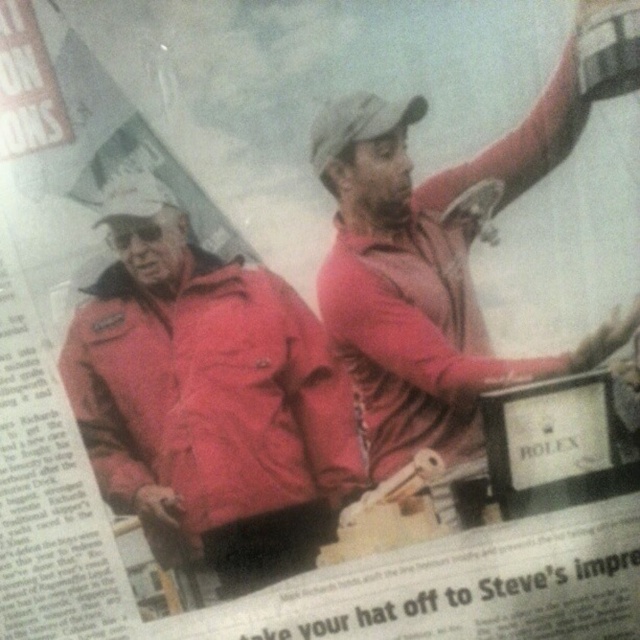
From the picture: Who is positioned more to the right, matte red jacket at center or matte red shirt at upper right?

From the viewer's perspective, matte red shirt at upper right appears more on the right side.

Who is shorter, matte red jacket at center or matte red shirt at upper right?

matte red jacket at center

Does point (209, 426) come behind point (385, 195)?

Yes, point (209, 426) is farther from viewer.

Image resolution: width=640 pixels, height=640 pixels. Identify the location of matte red jacket at center. (208, 397).